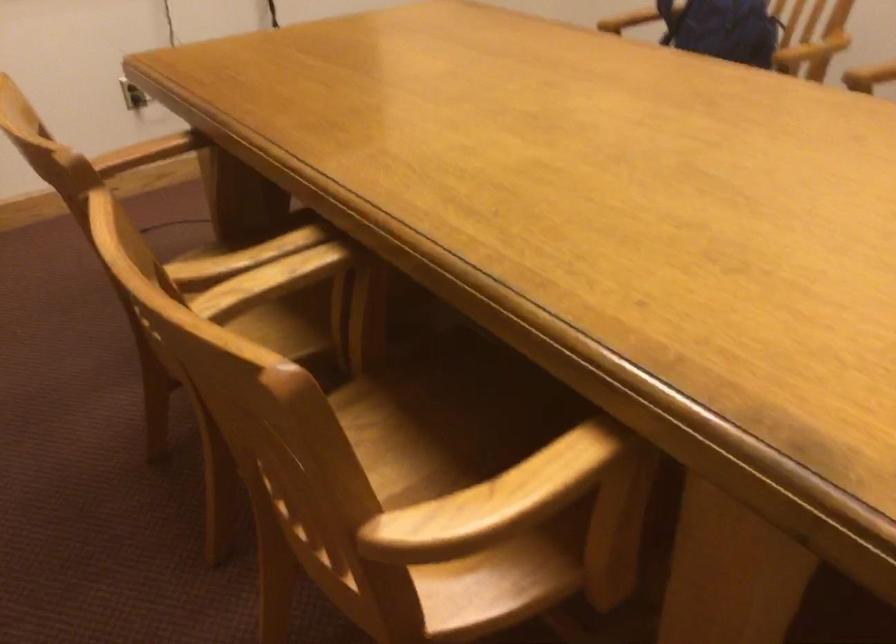
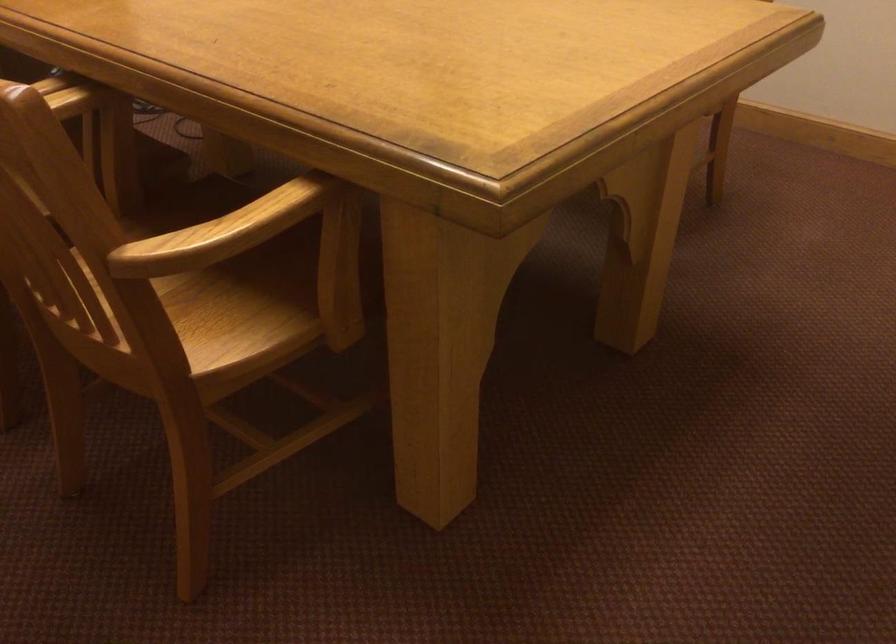
Where in the second image is the point corresponding to (471,564) from the first image?

(227, 327)